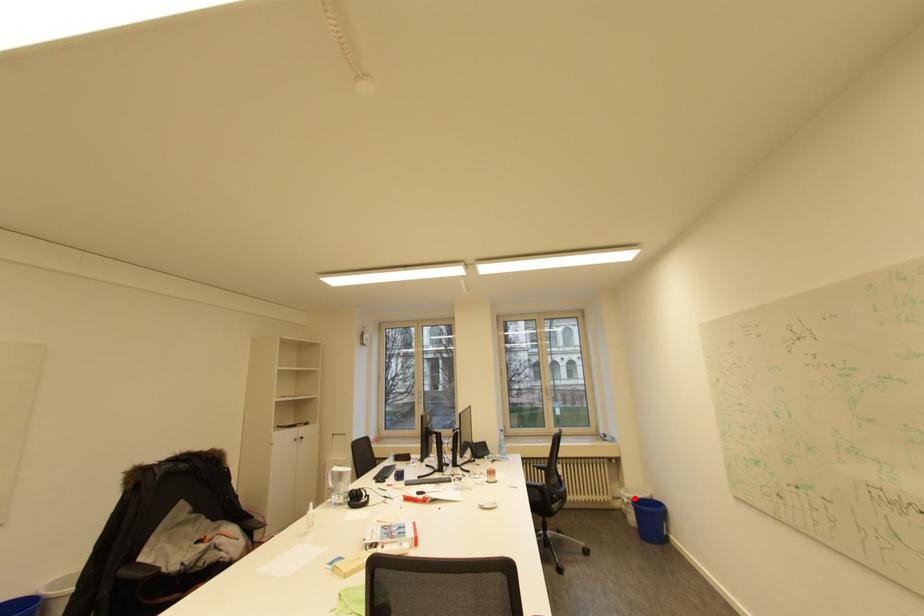
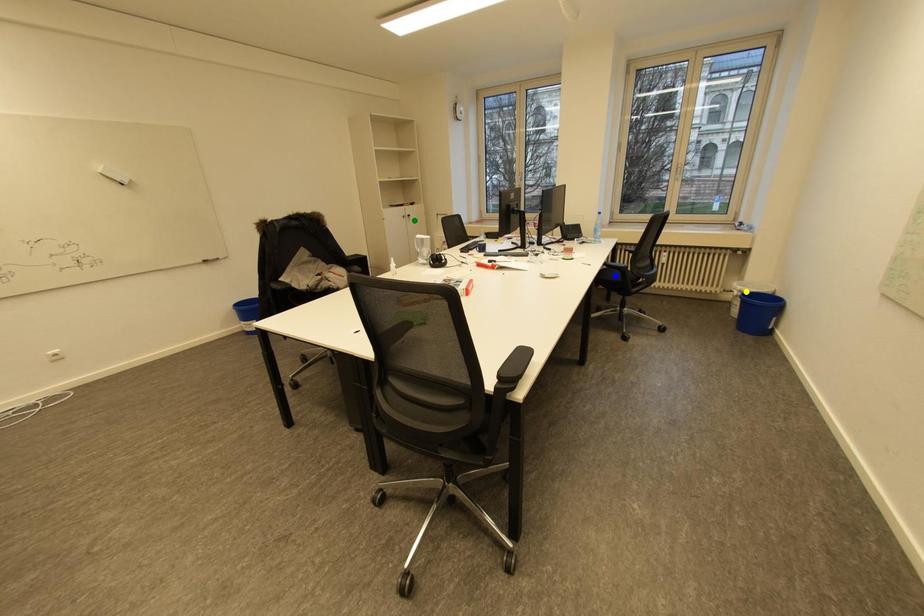
Question: I am providing you with two images of the same scene from different viewpoints. A red point is marked on the first image. You are given multiple points on the second image. Which point in image 2 is actually the same real-world point as the red point in image 1?

Choices:
 (A) green point
 (B) yellow point
 (C) blue point

Answer: (B)